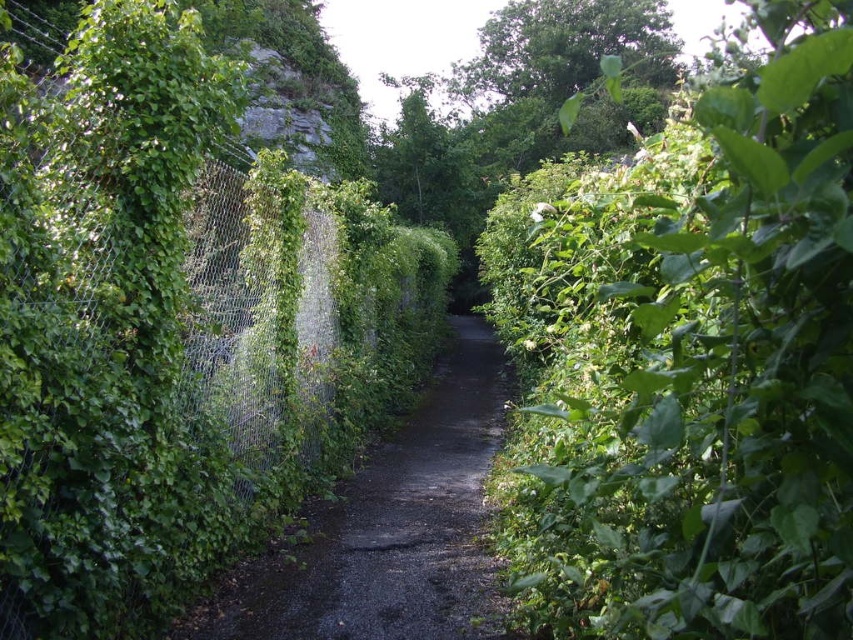
Does green leafy bush at right have a greater width compared to green leafy tree at center?

Incorrect, green leafy bush at right's width does not surpass green leafy tree at center's.

Is green leafy bush at right positioned in front of green leafy tree at center?

Yes, green leafy bush at right is closer to the viewer.

Is point (805, 83) positioned before point (505, 168)?

That is True.

Locate an element on the screen. This screenshot has width=853, height=640. green leafy bush at right is located at coordinates (693, 362).

Who is positioned more to the left, green leafy bush at right or dirt/gravel path at center?

Positioned to the left is dirt/gravel path at center.

Can you confirm if green leafy bush at right is thinner than dirt/gravel path at center?

In fact, green leafy bush at right might be wider than dirt/gravel path at center.

Is point (759, 3) behind point (460, 637)?

No, (759, 3) is in front of (460, 637).

This screenshot has width=853, height=640. I want to click on green leafy bush at right, so click(693, 362).

Can you confirm if dirt/gravel path at center is wider than green leafy tree at center?

In fact, dirt/gravel path at center might be narrower than green leafy tree at center.

Find the location of `dirt/gravel path at center`. dirt/gravel path at center is located at coordinates (393, 525).